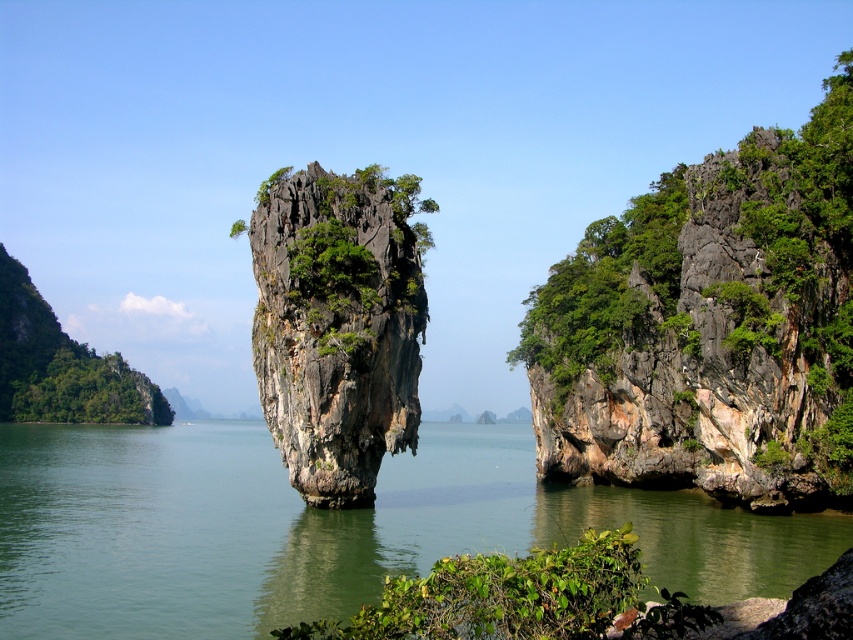
Question: Which of the following is the closest to the observer?

Choices:
 (A) green rough rock at right
 (B) green leafy tree at left
 (C) rugged stone rock at center

Answer: (A)

Question: Which object is the farthest from the green leafy bush at lower center?

Choices:
 (A) green water at center
 (B) rugged stone rock at center
 (C) green leafy tree at left

Answer: (C)

Question: Is green rough rock at right smaller than green leafy tree at left?

Choices:
 (A) no
 (B) yes

Answer: (B)

Question: Which point is closer to the camera?

Choices:
 (A) green leafy tree at left
 (B) rugged stone rock at center
 (C) green leafy bush at lower center
 (D) green rough rock at right

Answer: (C)

Question: Observing the image, what is the correct spatial positioning of green water at center in reference to rugged stone rock at center?

Choices:
 (A) above
 (B) below

Answer: (B)

Question: Is rugged stone rock at center thinner than green leafy tree at left?

Choices:
 (A) yes
 (B) no

Answer: (A)